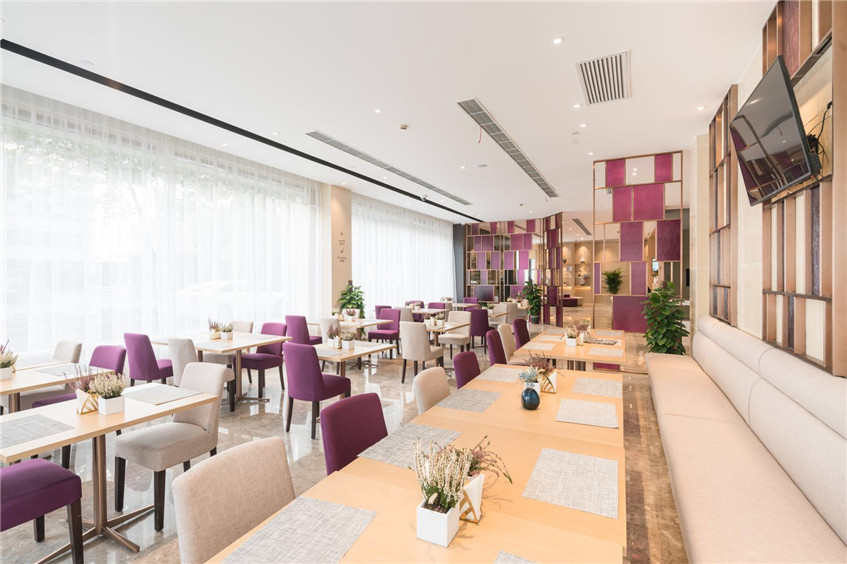
I want to click on cushions for white bench seating, so click(761, 533), click(799, 440), click(827, 383), click(745, 336), click(702, 342), click(705, 327), click(723, 387), click(682, 354), click(683, 378).